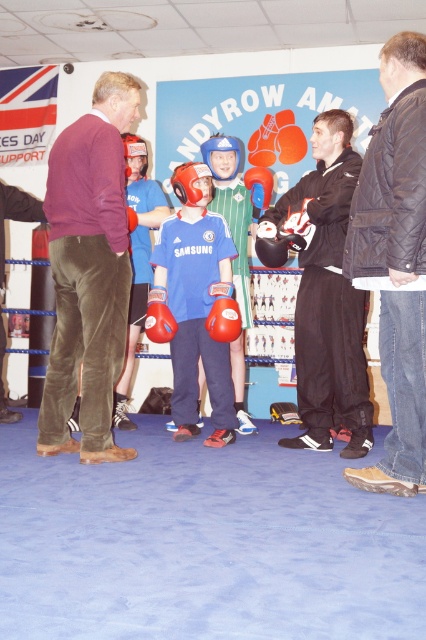
Question: Among these points, which one is farthest from the camera?

Choices:
 (A) (215, 332)
 (B) (83, 426)

Answer: (A)

Question: Can you confirm if black matte jacket at center is positioned to the right of red matte boxing glove at center?

Choices:
 (A) no
 (B) yes

Answer: (B)

Question: Which point is farther to the camera?

Choices:
 (A) maroon sweater at center
 (B) red matte boxing glove at center

Answer: (B)

Question: Which point is farther to the camera?

Choices:
 (A) (152, 317)
 (B) (57, 236)
 (C) (354, 296)

Answer: (A)

Question: From the image, what is the correct spatial relationship of black quilted jacket at right in relation to red matte boxing glove at center?

Choices:
 (A) right
 (B) left

Answer: (A)

Question: Where is black matte jacket at center located in relation to red leather boxing glove at center in the image?

Choices:
 (A) below
 (B) above

Answer: (B)